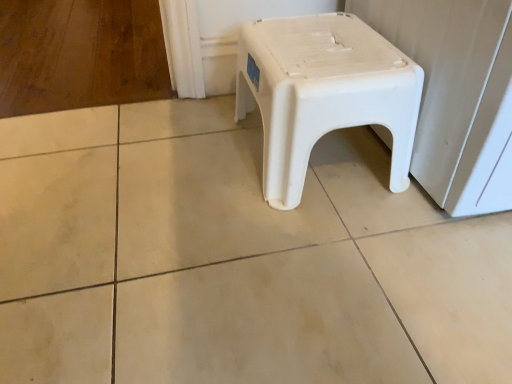
Question: Considering the relative positions of white plastic stool at center and white plastic stool at center-right in the image provided, is white plastic stool at center in front of white plastic stool at center-right?

Choices:
 (A) no
 (B) yes

Answer: (A)

Question: From a real-world perspective, is white plastic stool at center on top of white plastic stool at center-right?

Choices:
 (A) no
 (B) yes

Answer: (A)

Question: Can you confirm if white plastic stool at center is positioned to the right of white plastic stool at center-right?

Choices:
 (A) yes
 (B) no

Answer: (B)

Question: Does white plastic stool at center have a greater width compared to white plastic stool at center-right?

Choices:
 (A) yes
 (B) no

Answer: (B)

Question: Can you confirm if white plastic stool at center is positioned to the left of white plastic stool at center-right?

Choices:
 (A) no
 (B) yes

Answer: (B)

Question: Is the surface of white plastic stool at center in direct contact with white plastic stool at center-right?

Choices:
 (A) yes
 (B) no

Answer: (B)

Question: Is white plastic stool at center-right in contact with white plastic stool at center?

Choices:
 (A) yes
 (B) no

Answer: (B)

Question: Is white plastic stool at center-right completely or partially outside of white plastic stool at center?

Choices:
 (A) no
 (B) yes

Answer: (B)

Question: Can you confirm if white plastic stool at center-right is wider than white plastic stool at center?

Choices:
 (A) no
 (B) yes

Answer: (B)

Question: From the image's perspective, is white plastic stool at center-right located above white plastic stool at center?

Choices:
 (A) no
 (B) yes

Answer: (B)

Question: From a real-world perspective, is white plastic stool at center-right physically above white plastic stool at center?

Choices:
 (A) no
 (B) yes

Answer: (B)

Question: Could you tell me if white plastic stool at center-right is facing white plastic stool at center?

Choices:
 (A) yes
 (B) no

Answer: (B)

Question: From a real-world perspective, is white plastic stool at center positioned above or below white plastic stool at center-right?

Choices:
 (A) below
 (B) above

Answer: (A)